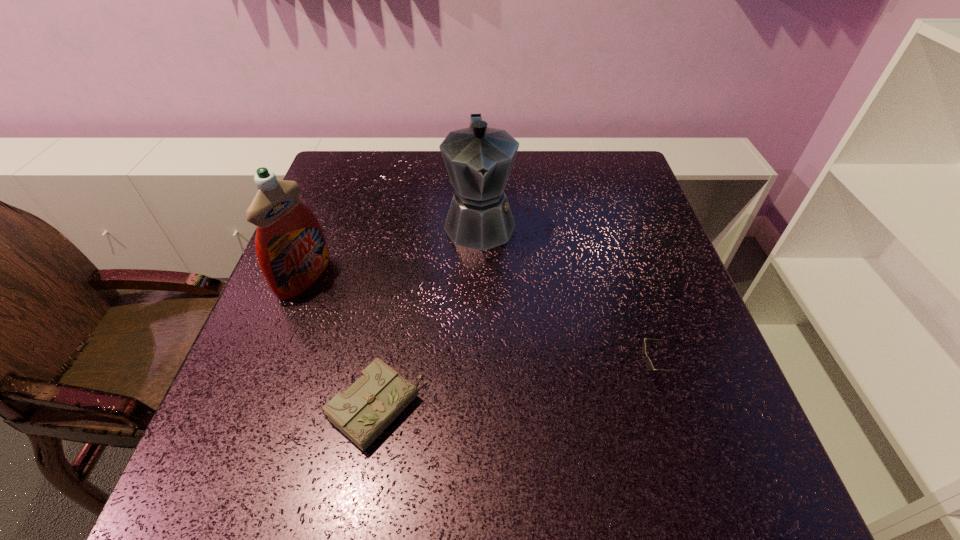
The height and width of the screenshot is (540, 960). Find the location of `vacant space in between the rightmost object and the coffeepot`. vacant space in between the rightmost object and the coffeepot is located at coordinates (567, 298).

Locate an element on the screen. The image size is (960, 540). free space between the third object from left to right and the third object from right to left is located at coordinates (428, 315).

Identify the location of free space between the coffeepot and the third tallest object. (567, 298).

Identify the location of empty location between the sunglasses and the leftmost object. (480, 325).

I want to click on free area in between the third object from left to right and the sunglasses, so click(x=567, y=298).

You are a GUI agent. You are given a task and a screenshot of the screen. Output one action in this format:
    pyautogui.click(x=<x>, y=<y>)
    Task: Click on the free space between the leftmost object and the third tallest object
    This screenshot has height=540, width=960.
    Given the screenshot: What is the action you would take?
    pyautogui.click(x=480, y=325)

Where is `vacant area that lies between the diary and the leftmost object`? vacant area that lies between the diary and the leftmost object is located at coordinates (341, 343).

I want to click on free area in between the third object from right to left and the second object from right to left, so click(428, 315).

Locate an element on the screen. The height and width of the screenshot is (540, 960). vacant space that's between the third tallest object and the diary is located at coordinates (516, 390).

Locate an element on the screen. The height and width of the screenshot is (540, 960). free space between the diary and the second shortest object is located at coordinates (516, 390).